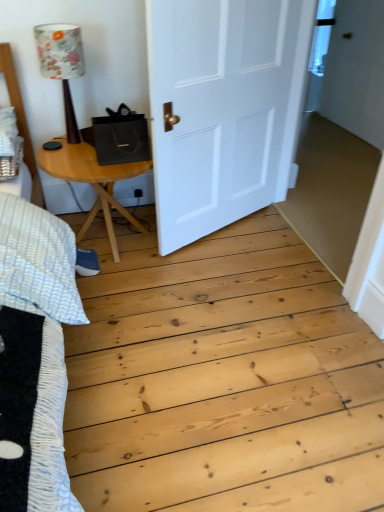
Question: Considering the relative positions of light brown wooden table at left and floral fabric lampshade at upper left in the image provided, is light brown wooden table at left to the right of floral fabric lampshade at upper left from the viewer's perspective?

Choices:
 (A) no
 (B) yes

Answer: (B)

Question: Is light brown wooden table at left located outside floral fabric lampshade at upper left?

Choices:
 (A) yes
 (B) no

Answer: (A)

Question: From the image's perspective, is light brown wooden table at left located above floral fabric lampshade at upper left?

Choices:
 (A) no
 (B) yes

Answer: (A)

Question: Can you confirm if light brown wooden table at left is smaller than floral fabric lampshade at upper left?

Choices:
 (A) yes
 (B) no

Answer: (B)

Question: Can you confirm if light brown wooden table at left is bigger than floral fabric lampshade at upper left?

Choices:
 (A) yes
 (B) no

Answer: (A)

Question: Considering the relative sizes of light brown wooden table at left and floral fabric lampshade at upper left in the image provided, is light brown wooden table at left shorter than floral fabric lampshade at upper left?

Choices:
 (A) no
 (B) yes

Answer: (B)

Question: Are floral fabric lampshade at upper left and white matte door at center far apart?

Choices:
 (A) no
 (B) yes

Answer: (A)

Question: From a real-world perspective, is floral fabric lampshade at upper left physically above white matte door at center?

Choices:
 (A) yes
 (B) no

Answer: (A)

Question: Is floral fabric lampshade at upper left smaller than white matte door at center?

Choices:
 (A) no
 (B) yes

Answer: (B)

Question: From the image's perspective, is floral fabric lampshade at upper left on top of white matte door at center?

Choices:
 (A) no
 (B) yes

Answer: (B)

Question: Is floral fabric lampshade at upper left behind white matte door at center?

Choices:
 (A) yes
 (B) no

Answer: (A)

Question: From the image's perspective, does floral fabric lampshade at upper left appear lower than white matte door at center?

Choices:
 (A) yes
 (B) no

Answer: (B)

Question: Considering the relative sizes of white matte door at center and light brown wooden table at left in the image provided, is white matte door at center thinner than light brown wooden table at left?

Choices:
 (A) no
 (B) yes

Answer: (B)